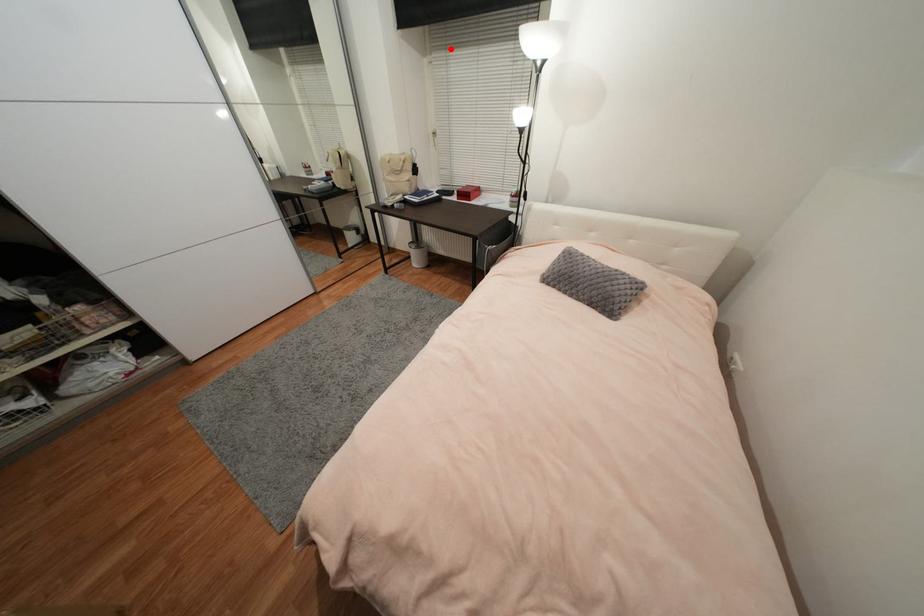
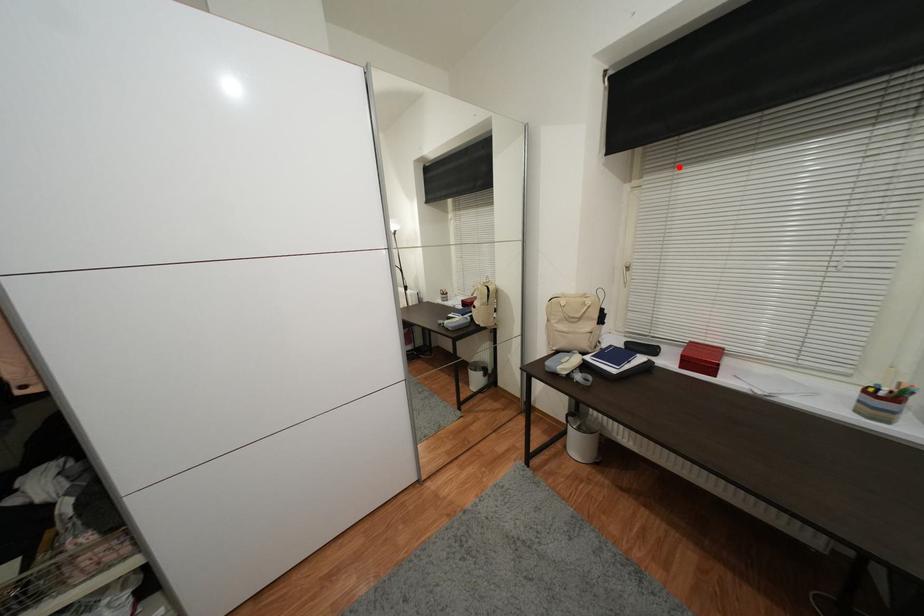
I am providing you with two images of the same scene from different viewpoints. A red point is marked on the first image and another point is marked on the second image. Does the point marked in image1 correspond to the same location as the one in image2?

Yes